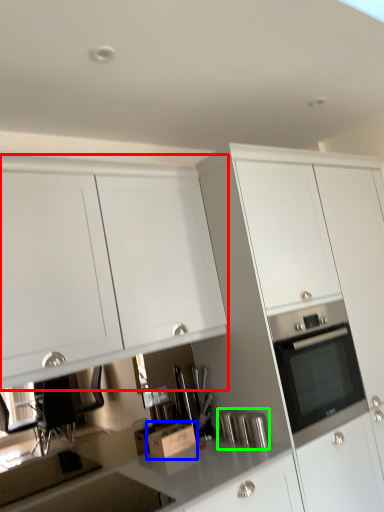
Question: Considering the real-world distances, which object is farthest from cabinetry (highlighted by a red box)? cardboard box (highlighted by a blue box) or appliance (highlighted by a green box)?

Choices:
 (A) cardboard box
 (B) appliance

Answer: (B)